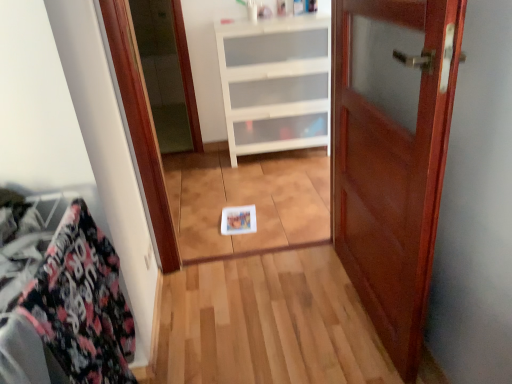
Find the location of a particular element. vacant area situated below mahogany wood door at center (from a real-world perspective) is located at coordinates (359, 308).